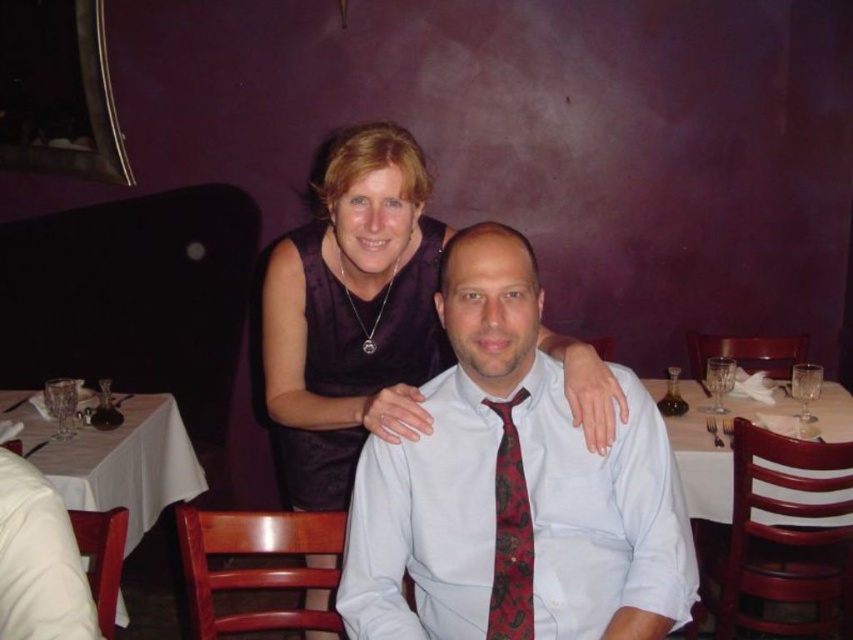
Question: Estimate the real-world distances between objects in this image. Which object is closer to the white cloth at lower left?

Choices:
 (A) red paisley fabric tie at center
 (B) white tablecloth at center

Answer: (A)

Question: Which object is closer to the camera taking this photo?

Choices:
 (A) white satin shirt at center
 (B) white cloth at lower left
 (C) purple satin dress at center

Answer: (A)

Question: Can you confirm if white satin shirt at center is wider than red paisley fabric tie at center?

Choices:
 (A) no
 (B) yes

Answer: (B)

Question: Is purple satin dress at center bigger than white cloth at lower left?

Choices:
 (A) no
 (B) yes

Answer: (A)

Question: Which point appears farthest from the camera in this image?

Choices:
 (A) (131, 433)
 (B) (598, 486)
 (C) (497, 584)

Answer: (A)

Question: Does white satin shirt at center have a greater width compared to white tablecloth at center?

Choices:
 (A) yes
 (B) no

Answer: (B)